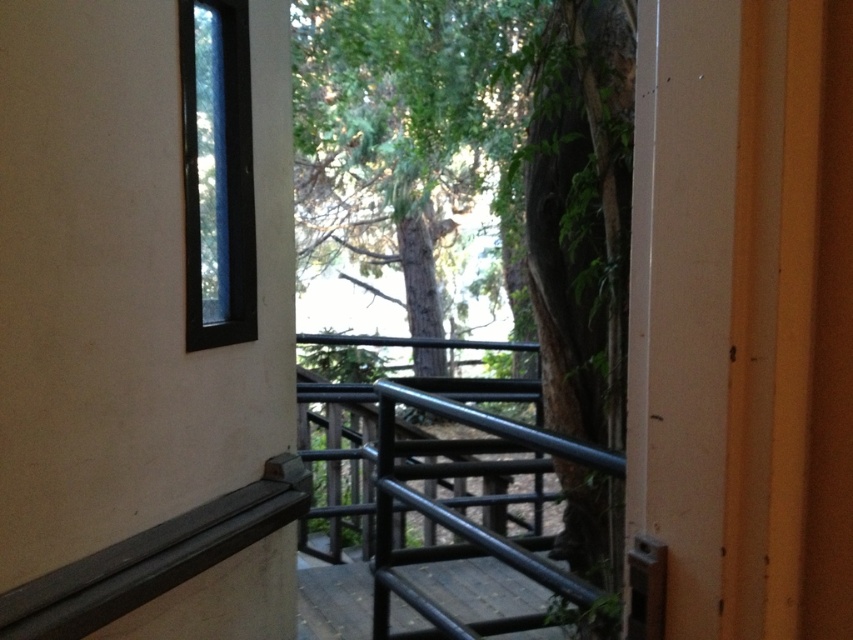
You are standing inside the building and want to exit through the black matte door at upper left. However, you notice a green leafy tree at center outside. Can you walk straight towards the door without any obstruction from the tree?

The black matte door at upper left is closer to the viewer than the green leafy tree at center, so there is no obstruction from the tree when walking straight towards the door.

You are trying to determine if the black matte door at upper left can fit through the space between the black metal railing at center and the wall. Based on their thickness, will it fit?

The black matte door at upper left is thinner than the black metal railing at center, so it can fit through the space between the black metal railing at center and the wall.